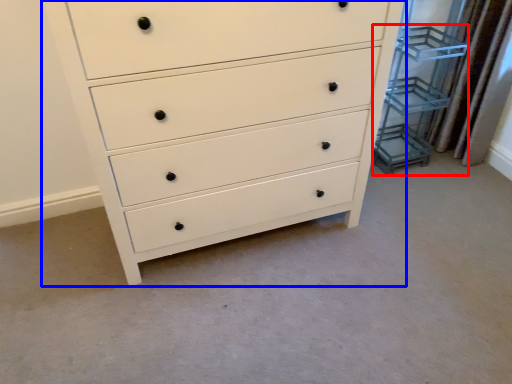
Question: Which object appears farthest to the camera in this image, cabinet (highlighted by a red box) or chest of drawers (highlighted by a blue box)?

Choices:
 (A) cabinet
 (B) chest of drawers

Answer: (A)